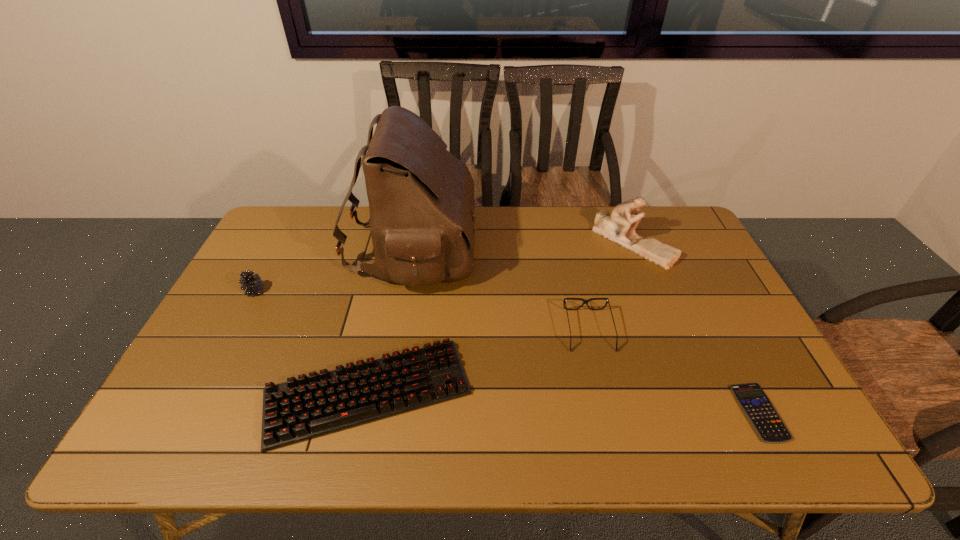
You are a GUI agent. You are given a task and a screenshot of the screen. Output one action in this format:
    pyautogui.click(x=<x>, y=<y>)
    Task: Click on the free space that is in between the third object from right to left and the tallest object
    
    Given the screenshot: What is the action you would take?
    pyautogui.click(x=501, y=289)

This screenshot has height=540, width=960. Find the location of `vacant space that is in between the satchel and the calculator`. vacant space that is in between the satchel and the calculator is located at coordinates (587, 330).

You are a GUI agent. You are given a task and a screenshot of the screen. Output one action in this format:
    pyautogui.click(x=<x>, y=<y>)
    Task: Click on the free space between the third tallest object and the satchel
    The width and height of the screenshot is (960, 540).
    Given the screenshot: What is the action you would take?
    pyautogui.click(x=334, y=269)

What are the coordinates of `vacant area that lies between the spectacles and the third tallest object` in the screenshot? It's located at (421, 310).

Identify the location of free spot between the leftmost object and the fourth tallest object. (421, 310).

I want to click on free spot between the fourth tallest object and the second tallest object, so click(611, 286).

Where is `object that can be found as the third closest to the figurine`? This screenshot has height=540, width=960. object that can be found as the third closest to the figurine is located at coordinates (759, 410).

Select which object appears as the fifth closest to the pinecone. Please provide its 2D coordinates. Your answer should be formatted as a tuple, i.e. [(x, y)], where the tuple contains the x and y coordinates of a point satisfying the conditions above.

[(759, 410)]

Where is `free point that satisfies the following two spatial constraints: 1. on the front flap of the tallest object; 2. on the front side of the second shortest object`? The width and height of the screenshot is (960, 540). free point that satisfies the following two spatial constraints: 1. on the front flap of the tallest object; 2. on the front side of the second shortest object is located at coordinates (388, 392).